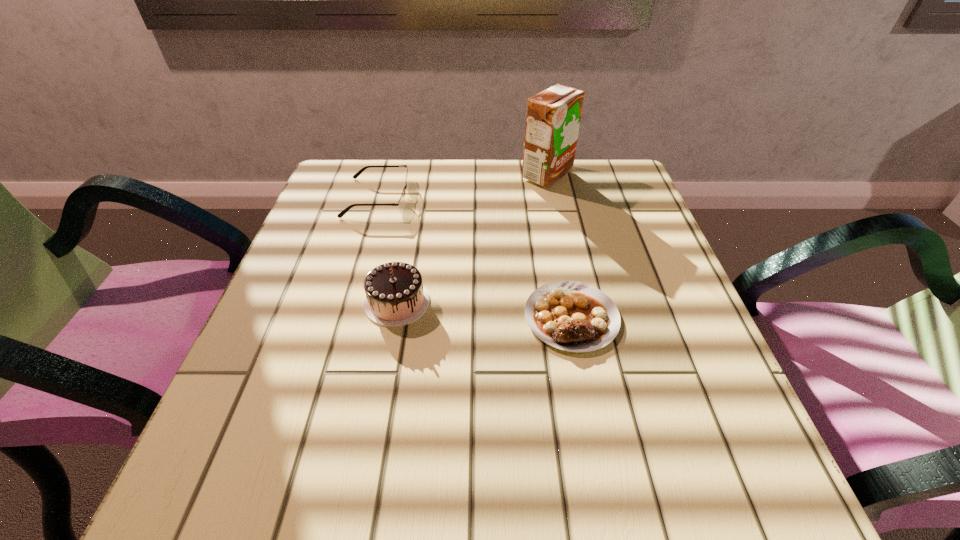
Identify the location of blank region between the spectacles and the shortest object. (474, 258).

You are a GUI agent. You are given a task and a screenshot of the screen. Output one action in this format:
    pyautogui.click(x=<x>, y=<y>)
    Task: Click on the blank region between the spectacles and the tallest object
    The width and height of the screenshot is (960, 540).
    Given the screenshot: What is the action you would take?
    pyautogui.click(x=463, y=186)

Identify the location of vacant area that lies between the second tallest object and the shortest object. The height and width of the screenshot is (540, 960). (484, 309).

At what (x,y) coordinates should I click in order to perform the action: click on object that is the third closest to the spectacles. Please return your answer as a coordinate pair (x, y). The image size is (960, 540). Looking at the image, I should click on (572, 316).

Identify the location of object that can be found as the closest to the chocolate cake. (572, 316).

Find the location of a particular element. vacant position in the image that satisfies the following two spatial constraints: 1. on the front side of the shortest object; 2. on the right side of the chocolate cake is located at coordinates (395, 317).

Identify the location of free spot that satisfies the following two spatial constraints: 1. on the back side of the steak; 2. on the front-facing side of the third tallest object. (548, 198).

In order to click on free region that satisfies the following two spatial constraints: 1. on the back side of the second tallest object; 2. on the front-facing side of the spectacles in this screenshot , I will do `click(417, 198)`.

Locate an element on the screen. Image resolution: width=960 pixels, height=540 pixels. free space that satisfies the following two spatial constraints: 1. on the straw side of the carton; 2. on the front side of the chocolate cake is located at coordinates (573, 302).

Locate an element on the screen. free space that satisfies the following two spatial constraints: 1. on the back side of the steak; 2. on the front-facing side of the spectacles is located at coordinates (548, 198).